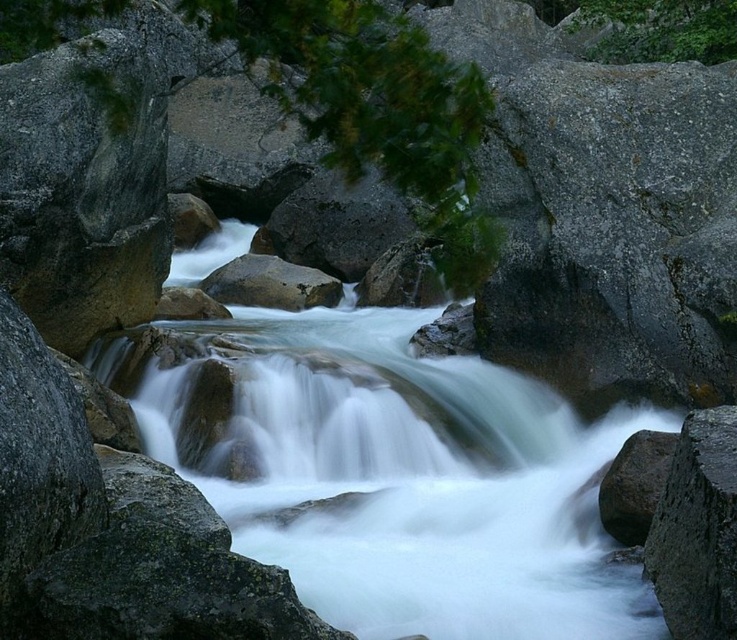
Question: Can you confirm if white smooth water at center is bigger than green leafy tree at center?

Choices:
 (A) no
 (B) yes

Answer: (A)

Question: Is smooth gray rock at right smaller than smooth gray rock at center?

Choices:
 (A) no
 (B) yes

Answer: (B)

Question: Estimate the real-world distances between objects in this image. Which object is closer to the smooth gray rock at center?

Choices:
 (A) green leafy tree at center
 (B) smooth gray rock at right
 (C) white smooth water at center

Answer: (C)

Question: Which point is closer to the camera taking this photo?

Choices:
 (A) (321, 58)
 (B) (436, 362)

Answer: (A)

Question: Which object is closer to the camera taking this photo?

Choices:
 (A) smooth gray rock at right
 (B) smooth gray rock at center
 (C) green leafy tree at center

Answer: (C)

Question: Can you confirm if green leafy tree at center is positioned above smooth gray rock at center?

Choices:
 (A) no
 (B) yes

Answer: (B)